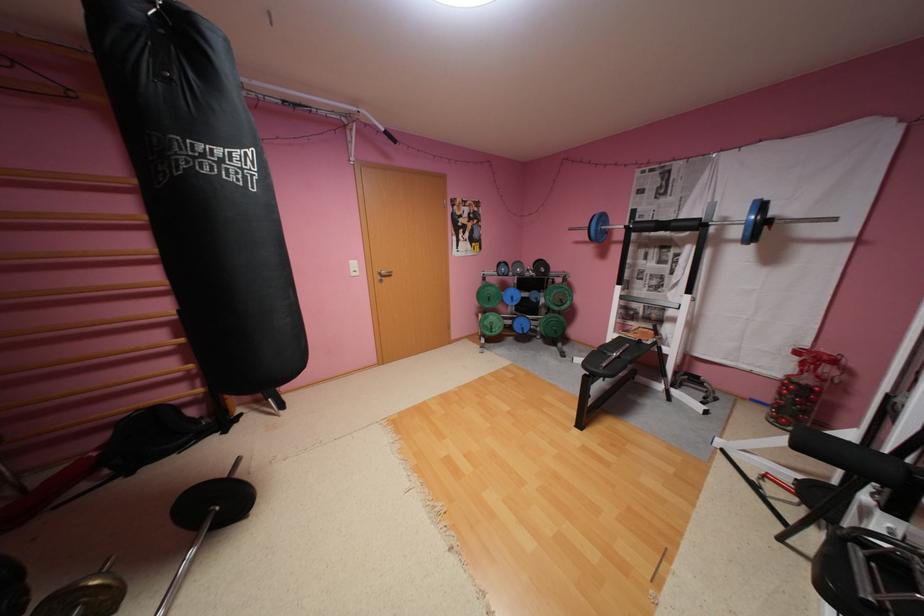
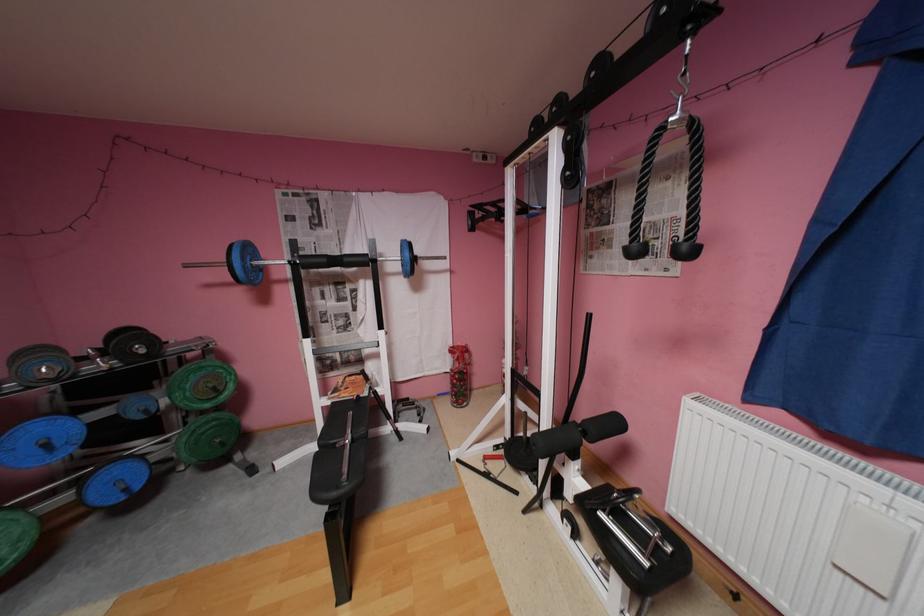
Where in the second image is the point corresponding to pixel 521 298 from the first image?

(55, 445)